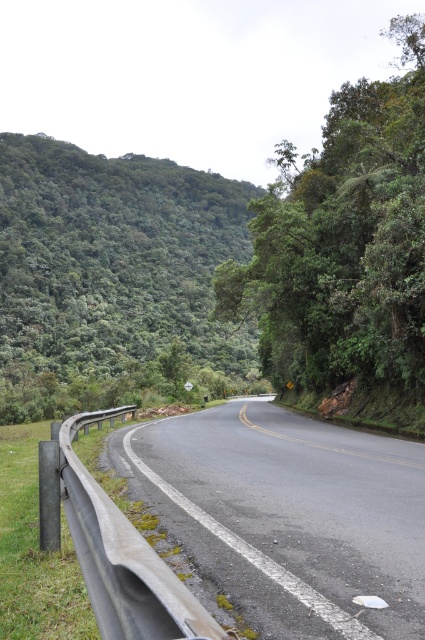
Does green leafy tree at left lie in front of green leafy tree at upper right?

No, it is behind green leafy tree at upper right.

The image size is (425, 640). Find the location of `green leafy tree at left`. green leafy tree at left is located at coordinates (115, 280).

Who is higher up, gray metallic guardrail at left or green leafy tree at upper right?

Positioned higher is green leafy tree at upper right.

Can you confirm if gray metallic guardrail at left is thinner than green leafy tree at upper right?

Correct, gray metallic guardrail at left's width is less than green leafy tree at upper right's.

Is point (393, 582) farther from viewer compared to point (345, 186)?

No, it is not.

In order to click on gray metallic guardrail at left in this screenshot , I will do `click(289, 515)`.

Consider the image. Does green leafy tree at left appear on the right side of gray metallic guardrail at left?

Incorrect, green leafy tree at left is not on the right side of gray metallic guardrail at left.

Between green leafy tree at left and gray metallic guardrail at left, which one is positioned lower?

gray metallic guardrail at left is lower down.

At what (x,y) coordinates should I click in order to perform the action: click on green leafy tree at left. Please return your answer as a coordinate pair (x, y). Looking at the image, I should click on (115, 280).